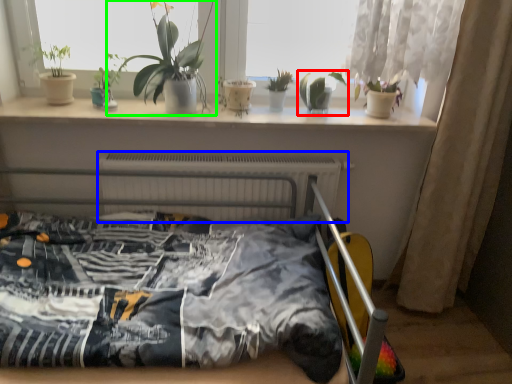
Question: Which object is positioned closest to houseplant (highlighted by a red box)? Select from radiator (highlighted by a blue box) and houseplant (highlighted by a green box).

Choices:
 (A) radiator
 (B) houseplant

Answer: (A)